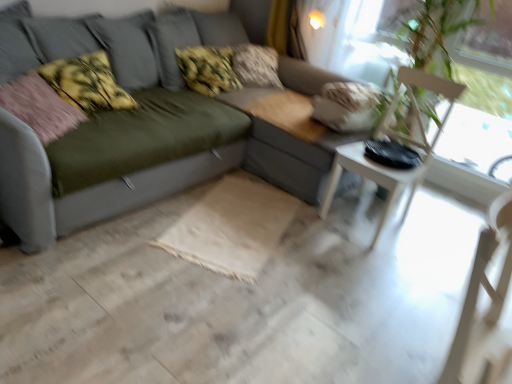
At what (x,y) coordinates should I click in order to perform the action: click on pink fabric pillow at left, marked as the first pillow in a front-to-back arrangement. Please return your answer as a coordinate pair (x, y). Looking at the image, I should click on (39, 107).

Describe the element at coordinates (256, 66) in the screenshot. I see `fluffy beige pillow at upper center, the first pillow from the back` at that location.

This screenshot has width=512, height=384. What do you see at coordinates (486, 309) in the screenshot?
I see `white wood armchair at right, marked as the first armchair in a front-to-back arrangement` at bounding box center [486, 309].

What do you see at coordinates (207, 69) in the screenshot?
I see `fluffy yellow-green pillow at center, which is the 3th pillow from front to back` at bounding box center [207, 69].

Measure the distance between transparent glass window screen at upper right and camera.

transparent glass window screen at upper right and camera are 9.48 feet apart from each other.

Find the location of a particular element. This screenshot has width=512, height=384. white wood chair at right, which ranks as the second armchair in front-to-back order is located at coordinates (394, 138).

Which of these two, fluffy pink pillow at left, the 3th pillow in the back-to-front sequence, or fluffy yellow-green pillow at center, which is the 3th pillow from front to back, is wider?

Wider between the two is fluffy pink pillow at left, the 3th pillow in the back-to-front sequence.

Is fluffy pink pillow at left, the 3th pillow in the back-to-front sequence, inside the boundaries of fluffy yellow-green pillow at center, the 2th pillow when ordered from back to front, or outside?

fluffy pink pillow at left, the 3th pillow in the back-to-front sequence, is not inside fluffy yellow-green pillow at center, the 2th pillow when ordered from back to front, it's outside.

Who is taller, fluffy pink pillow at left, the 3th pillow in the back-to-front sequence, or fluffy yellow-green pillow at center, the 2th pillow when ordered from back to front?

With more height is fluffy yellow-green pillow at center, the 2th pillow when ordered from back to front.

Between point (98, 83) and point (202, 70), which one is positioned in front?

Point (98, 83)

Consider the image. Is fluffy yellow-green pillow at center, which is the 3th pillow from front to back, oriented away from pink fabric pillow at left, marked as the first pillow in a front-to-back arrangement?

That's not correct — fluffy yellow-green pillow at center, which is the 3th pillow from front to back, is not looking away from pink fabric pillow at left, marked as the first pillow in a front-to-back arrangement.

From a real-world perspective, is fluffy yellow-green pillow at center, which is the 3th pillow from front to back, over pink fabric pillow at left, marked as the first pillow in a front-to-back arrangement?

Yes, from a real-world perspective, fluffy yellow-green pillow at center, which is the 3th pillow from front to back, is above pink fabric pillow at left, marked as the first pillow in a front-to-back arrangement.

Which object is more forward, fluffy yellow-green pillow at center, which is the 3th pillow from front to back, or pink fabric pillow at left, marked as the first pillow in a front-to-back arrangement?

pink fabric pillow at left, marked as the first pillow in a front-to-back arrangement, is in front.

There is a pink fabric pillow at left, marked as the first pillow in a front-to-back arrangement. Identify the location of the 1st pillow above it (from a real-world perspective). The image size is (512, 384). (207, 69).

Is fluffy beige pillow at upper center, the 4th pillow in the front-to-back sequence, aimed at white wood chair at right, the 1th armchair positioned from the back?

Yes.

Which object is more forward, fluffy beige pillow at upper center, the first pillow from the back, or white wood chair at right, which ranks as the second armchair in front-to-back order?

white wood chair at right, which ranks as the second armchair in front-to-back order.

Is fluffy beige pillow at upper center, the first pillow from the back, not close to white wood chair at right, the 1th armchair positioned from the back?

Yes, fluffy beige pillow at upper center, the first pillow from the back, and white wood chair at right, the 1th armchair positioned from the back, are quite far apart.

Between fluffy beige pillow at upper center, the first pillow from the back, and white wood chair at right, the 1th armchair positioned from the back, which one has smaller width?

fluffy beige pillow at upper center, the first pillow from the back, is thinner.

Looking at this image, in terms of size, does fluffy beige pillow at upper center, the 4th pillow in the front-to-back sequence, appear bigger or smaller than transparent glass window screen at upper right?

fluffy beige pillow at upper center, the 4th pillow in the front-to-back sequence, is smaller than transparent glass window screen at upper right.

Does fluffy beige pillow at upper center, the first pillow from the back, turn towards transparent glass window screen at upper right?

Yes.

Does fluffy beige pillow at upper center, the 4th pillow in the front-to-back sequence, contain transparent glass window screen at upper right?

Definitely not — transparent glass window screen at upper right is not inside fluffy beige pillow at upper center, the 4th pillow in the front-to-back sequence.

Which is behind, fluffy beige pillow at upper center, the first pillow from the back, or transparent glass window screen at upper right?

fluffy beige pillow at upper center, the first pillow from the back.

How different are the orientations of white wood chair at right, which ranks as the second armchair in front-to-back order, and green leafy plant at upper right in degrees?

There is a 4.31-degree angle between the facing directions of white wood chair at right, which ranks as the second armchair in front-to-back order, and green leafy plant at upper right.

Does white wood chair at right, the 1th armchair positioned from the back, appear on the right side of green leafy plant at upper right?

In fact, white wood chair at right, the 1th armchair positioned from the back, is to the left of green leafy plant at upper right.

Considering the relative sizes of white wood chair at right, which ranks as the second armchair in front-to-back order, and green leafy plant at upper right in the image provided, is white wood chair at right, which ranks as the second armchair in front-to-back order, shorter than green leafy plant at upper right?

Yes.

Could you tell me if white wood chair at right, which ranks as the second armchair in front-to-back order, is facing green leafy plant at upper right?

No, white wood chair at right, which ranks as the second armchair in front-to-back order, is not facing towards green leafy plant at upper right.

Between fluffy pink pillow at left, marked as the 2th pillow in a front-to-back arrangement, and transparent glass window screen at upper right, which one appears on the left side from the viewer's perspective?

fluffy pink pillow at left, marked as the 2th pillow in a front-to-back arrangement, is more to the left.

Which of these two, fluffy pink pillow at left, the 3th pillow in the back-to-front sequence, or transparent glass window screen at upper right, is bigger?

Bigger between the two is transparent glass window screen at upper right.

Which is behind, fluffy pink pillow at left, marked as the 2th pillow in a front-to-back arrangement, or transparent glass window screen at upper right?

Positioned behind is fluffy pink pillow at left, marked as the 2th pillow in a front-to-back arrangement.

Measure the distance from fluffy pink pillow at left, marked as the 2th pillow in a front-to-back arrangement, to transparent glass window screen at upper right.

fluffy pink pillow at left, marked as the 2th pillow in a front-to-back arrangement, and transparent glass window screen at upper right are 5.64 feet apart.

How many degrees apart are the facing directions of transparent glass window screen at upper right and fluffy yellow-green pillow at center, which is the 3th pillow from front to back?

There is a 95.1-degree angle between the facing directions of transparent glass window screen at upper right and fluffy yellow-green pillow at center, which is the 3th pillow from front to back.

Which is correct: transparent glass window screen at upper right is inside fluffy yellow-green pillow at center, which is the 3th pillow from front to back, or outside of it?

transparent glass window screen at upper right lies outside fluffy yellow-green pillow at center, which is the 3th pillow from front to back.

Considering the sizes of objects transparent glass window screen at upper right and fluffy yellow-green pillow at center, the 2th pillow when ordered from back to front, in the image provided, who is shorter, transparent glass window screen at upper right or fluffy yellow-green pillow at center, the 2th pillow when ordered from back to front,?

fluffy yellow-green pillow at center, the 2th pillow when ordered from back to front.

From the image's perspective, is transparent glass window screen at upper right positioned above or below fluffy yellow-green pillow at center, the 2th pillow when ordered from back to front?

transparent glass window screen at upper right is situated lower than fluffy yellow-green pillow at center, the 2th pillow when ordered from back to front, in the image.

From the image's perspective, starting from the fluffy pink pillow at left, marked as the 2th pillow in a front-to-back arrangement, which pillow is the 1st one above? Please provide its 2D coordinates.

[(207, 69)]

There is a fluffy yellow-green pillow at center, the 2th pillow when ordered from back to front. At what (x,y) coordinates should I click in order to perform the action: click on the 2nd pillow below it (from the image's perspective). Please return your answer as a coordinate pair (x, y). This screenshot has width=512, height=384. Looking at the image, I should click on (39, 107).

Which object lies further to the anchor point white wood chair at right, the 1th armchair positioned from the back, white wood armchair at right, marked as the first armchair in a front-to-back arrangement, or transparent glass window screen at upper right?

white wood armchair at right, marked as the first armchair in a front-to-back arrangement.

Which object lies nearer to the anchor point white wood armchair at right, marked as the first armchair in a front-to-back arrangement, pink fabric pillow at left, marked as the first pillow in a front-to-back arrangement, or green leafy plant at upper right?

green leafy plant at upper right is positioned closer to the anchor white wood armchair at right, marked as the first armchair in a front-to-back arrangement.

Looking at this image, considering their positions, is matte gray couch at center positioned closer to green leafy plant at upper right than white wood armchair at right, placed as the second armchair when sorted from back to front?

The object closer to green leafy plant at upper right is matte gray couch at center.

Looking at the image, which one is located further to fluffy yellow-green pillow at center, which is the 3th pillow from front to back, white wood chair at right, the 1th armchair positioned from the back, or pink fabric pillow at left, marked as the first pillow in a front-to-back arrangement?

The object further to fluffy yellow-green pillow at center, which is the 3th pillow from front to back, is white wood chair at right, the 1th armchair positioned from the back.

Looking at the image, which one is located further to transparent glass window screen at upper right, green leafy plant at upper right or fluffy pink pillow at left, marked as the 2th pillow in a front-to-back arrangement?

The object further to transparent glass window screen at upper right is fluffy pink pillow at left, marked as the 2th pillow in a front-to-back arrangement.

Looking at this image, from the image, which object appears to be nearer to fluffy yellow-green pillow at center, which is the 3th pillow from front to back, white wood armchair at right, placed as the second armchair when sorted from back to front, or fluffy beige pillow at upper center, the first pillow from the back?

fluffy beige pillow at upper center, the first pillow from the back.

Estimate the real-world distances between objects in this image. Which object is further from white wood armchair at right, placed as the second armchair when sorted from back to front, green leafy plant at upper right or fluffy beige pillow at upper center, the 4th pillow in the front-to-back sequence?

fluffy beige pillow at upper center, the 4th pillow in the front-to-back sequence, lies further to white wood armchair at right, placed as the second armchair when sorted from back to front, than the other object.

From the image, which object appears to be farther from matte gray couch at center, fluffy pink pillow at left, the 3th pillow in the back-to-front sequence, or green leafy plant at upper right?

green leafy plant at upper right.

Locate an element on the screen. This screenshot has height=384, width=512. studio couch situated between fluffy pink pillow at left, marked as the 2th pillow in a front-to-back arrangement, and white wood chair at right, which ranks as the second armchair in front-to-back order, from left to right is located at coordinates (86, 189).

This screenshot has width=512, height=384. I want to click on window screen between white wood armchair at right, placed as the second armchair when sorted from back to front, and fluffy beige pillow at upper center, the 4th pillow in the front-to-back sequence, from front to back, so click(352, 37).

Where is `pillow between fluffy yellow-green pillow at center, the 2th pillow when ordered from back to front, and white wood chair at right, which ranks as the second armchair in front-to-back order, from left to right`? pillow between fluffy yellow-green pillow at center, the 2th pillow when ordered from back to front, and white wood chair at right, which ranks as the second armchair in front-to-back order, from left to right is located at coordinates (256, 66).

Locate an element on the screen. plant between white wood armchair at right, placed as the second armchair when sorted from back to front, and fluffy beige pillow at upper center, the first pillow from the back, along the z-axis is located at coordinates (431, 31).